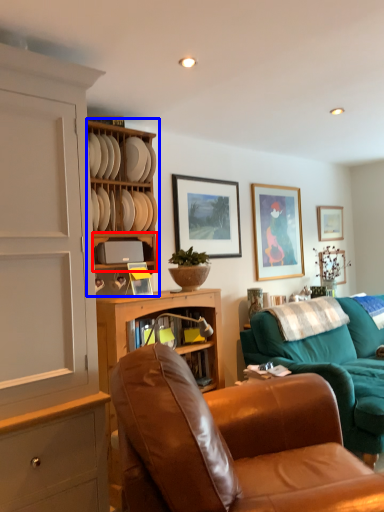
Question: Which point is further to the camera, shelf (highlighted by a red box) or shelf (highlighted by a blue box)?

Choices:
 (A) shelf
 (B) shelf

Answer: (A)